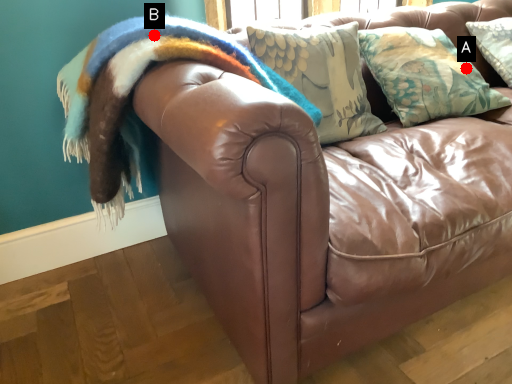
Question: Two points are circled on the image, labeled by A and B beside each circle. Which point is further to the camera?

Choices:
 (A) A is further
 (B) B is further

Answer: (A)